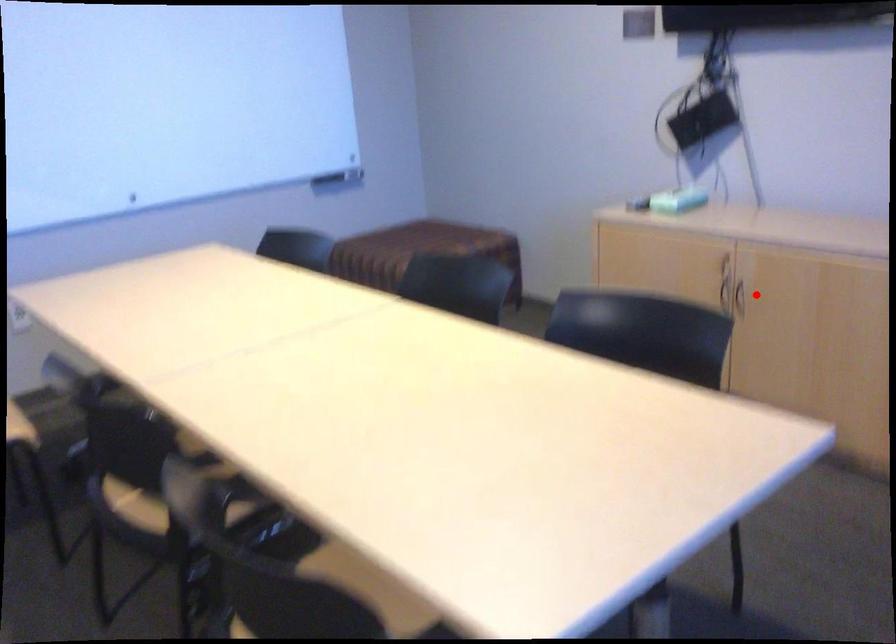
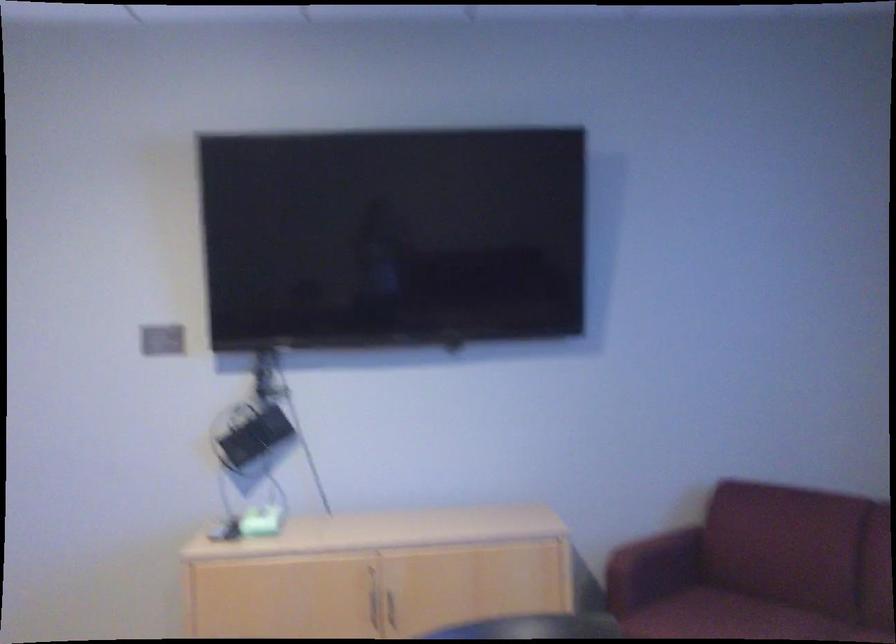
Find the pixel in the second image that matches the highlighted location in the first image.

(392, 607)